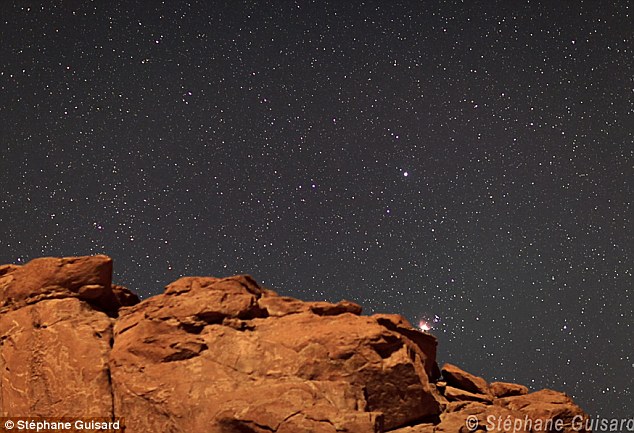
Identify the location of light. (411, 290).